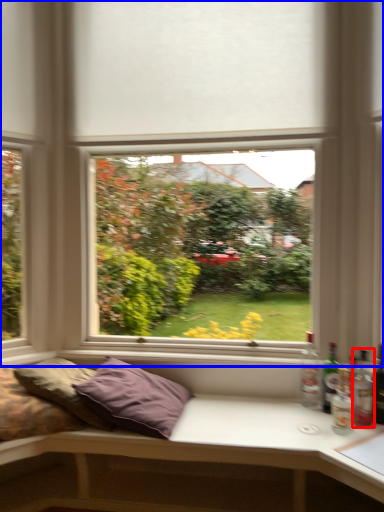
Question: Which of the following is the farthest to the observer, bottle (highlighted by a red box) or window (highlighted by a blue box)?

Choices:
 (A) bottle
 (B) window

Answer: (B)